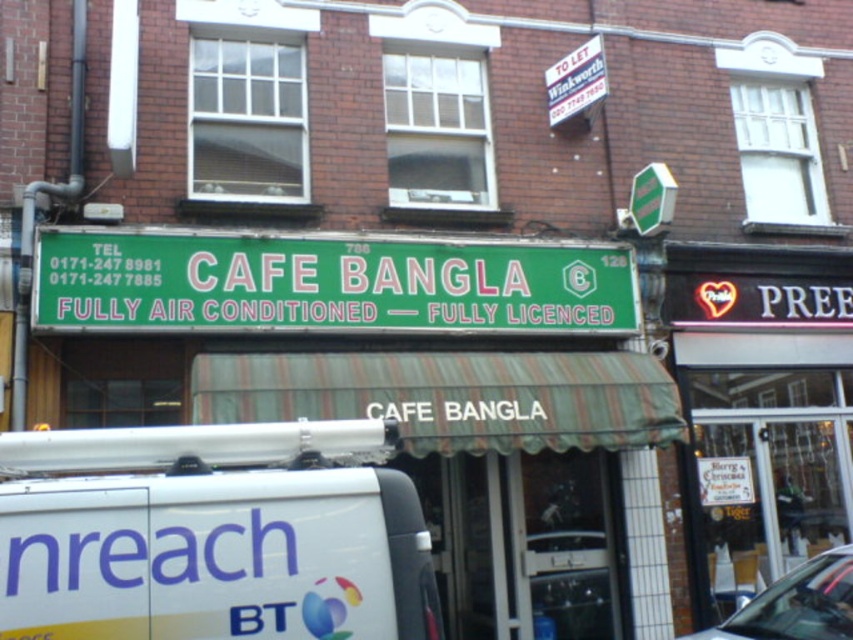
You are a delivery person approaching the Cafe Bangla. You see a white matte van at lower left and a metallic silver car at lower right parked near the entrance. Which vehicle is closer to you as you approach the entrance?

The white matte van at lower left is closer to the viewer than the metallic silver car at lower right, so the white matte van at lower left is closer to you as you approach the entrance.

You are a delivery driver who needs to park your metallic silver car at lower right near the green plastic sign at center. Can you park your car so that it doesn not block the sign?

The green plastic sign at center is taller than the metallic silver car at lower right. Since the sign is taller, parking the metallic silver car at lower right near it won not block the sign as long as there is enough space around the sign.